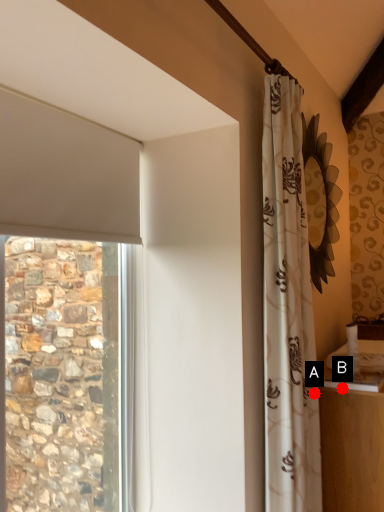
Question: Two points are circled on the image, labeled by A and B beside each circle. Which point is closer to the camera?

Choices:
 (A) A is closer
 (B) B is closer

Answer: (A)